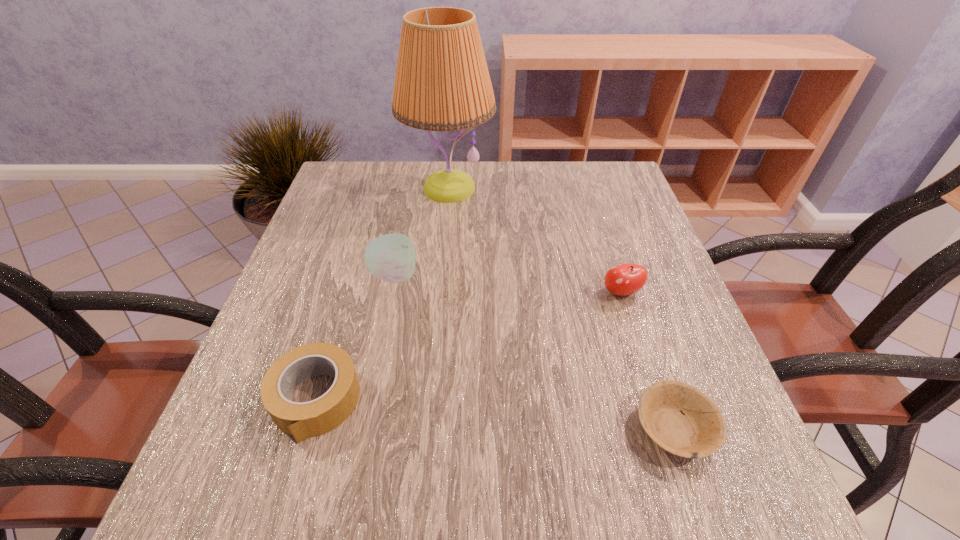
Where is `lamp`? This screenshot has height=540, width=960. lamp is located at coordinates (442, 83).

Locate an element on the screen. the farthest object is located at coordinates click(x=442, y=83).

The width and height of the screenshot is (960, 540). I want to click on the taller apple, so click(x=391, y=257).

Image resolution: width=960 pixels, height=540 pixels. Find the location of `the left apple`. the left apple is located at coordinates (391, 257).

Locate an element on the screen. This screenshot has width=960, height=540. the shorter apple is located at coordinates (624, 279).

This screenshot has width=960, height=540. I want to click on the right apple, so click(624, 279).

This screenshot has height=540, width=960. I want to click on the second shortest object, so click(302, 420).

The width and height of the screenshot is (960, 540). I want to click on bowl, so click(698, 431).

Image resolution: width=960 pixels, height=540 pixels. What are the coordinates of `vacant space located 0.140m on the side of the lamp near the pull switch` in the screenshot? It's located at (443, 253).

Identify the location of vacant space located on the back of the left apple. The height and width of the screenshot is (540, 960). (411, 193).